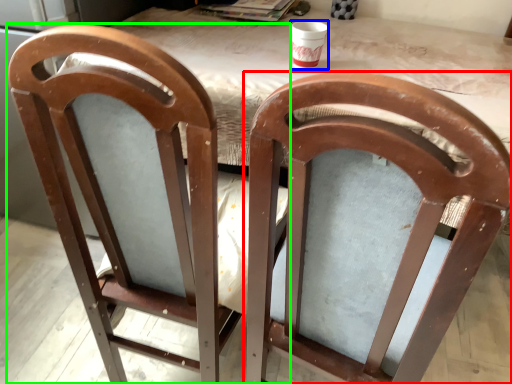
Question: Which is farther away from chair (highlighted by a red box)? cup (highlighted by a blue box) or chair (highlighted by a green box)?

Choices:
 (A) cup
 (B) chair

Answer: (A)